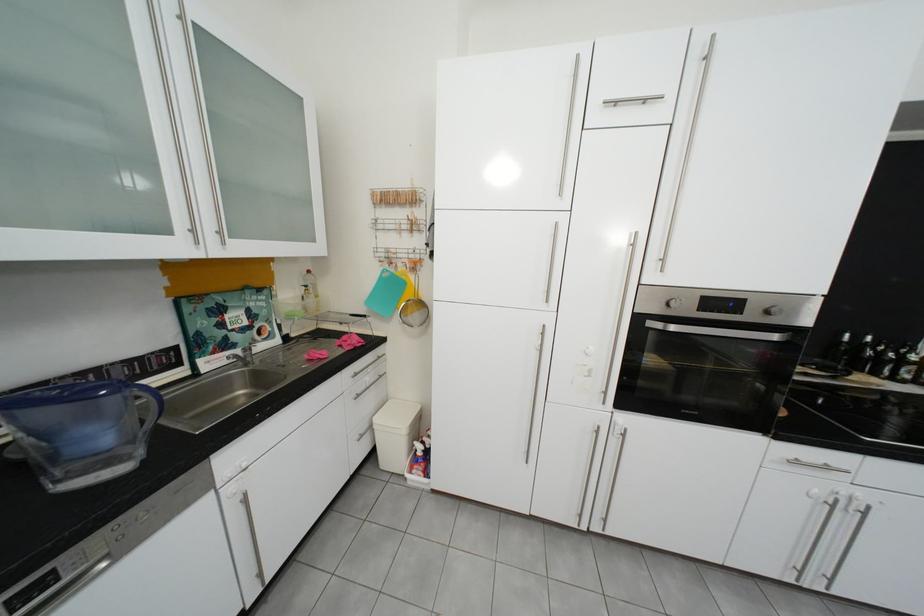
This screenshot has height=616, width=924. What do you see at coordinates (396, 416) in the screenshot? I see `a white trash can lid` at bounding box center [396, 416].